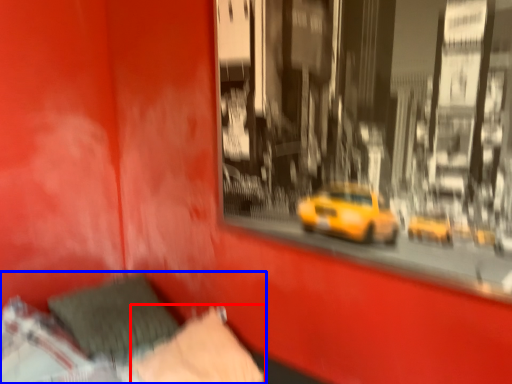
Question: Which of the following is the farthest to the observer, pillow (highlighted by a red box) or bed (highlighted by a blue box)?

Choices:
 (A) pillow
 (B) bed

Answer: (A)